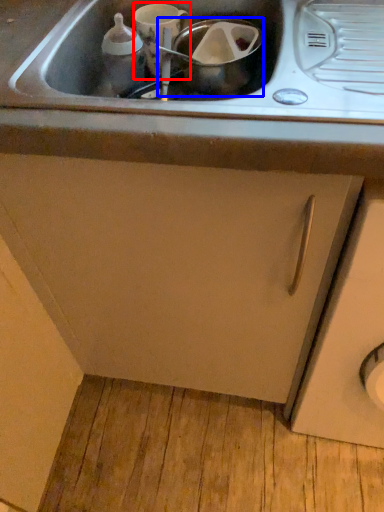
Question: Which of the following is the farthest to the observer, appliance (highlighted by a red box) or appliance (highlighted by a blue box)?

Choices:
 (A) appliance
 (B) appliance

Answer: (A)